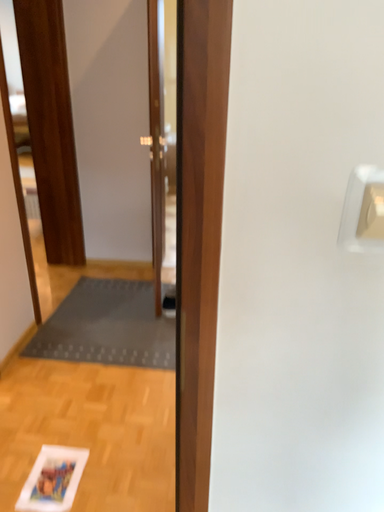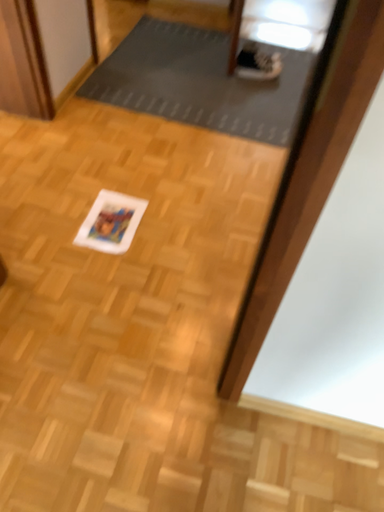
Question: How did the camera likely rotate when shooting the video?

Choices:
 (A) rotated downward
 (B) rotated upward

Answer: (A)